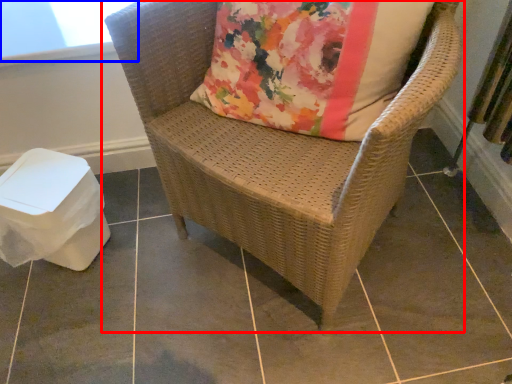
Question: Which object appears closest to the camera in this image, chair (highlighted by a red box) or window screen (highlighted by a blue box)?

Choices:
 (A) chair
 (B) window screen

Answer: (A)